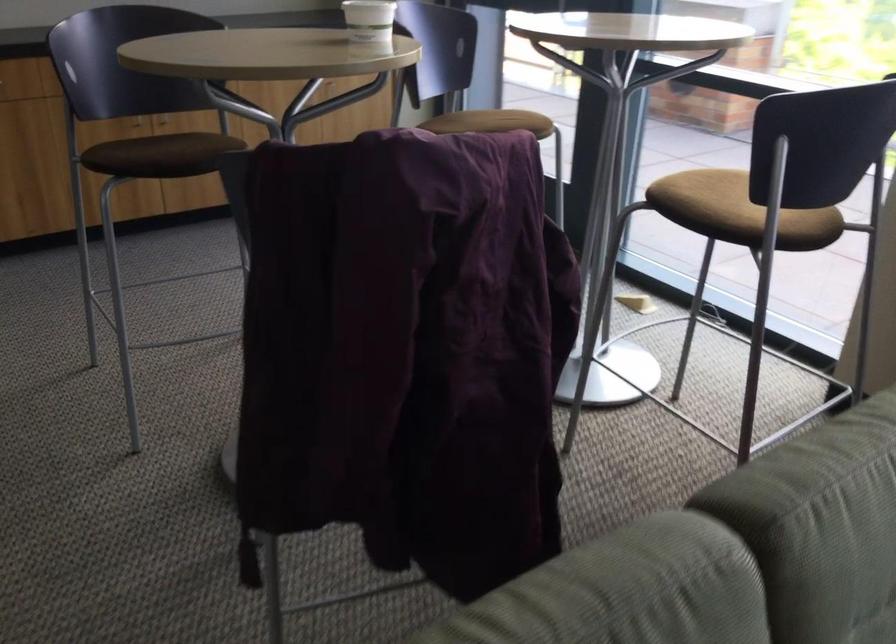
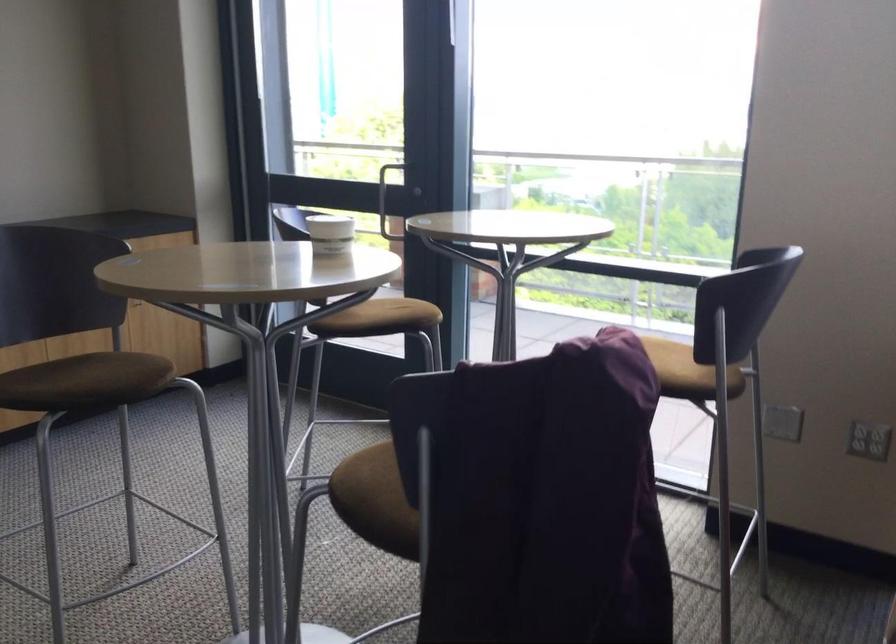
In the second image, find the point that corresponds to the point at 501,122 in the first image.

(401, 314)